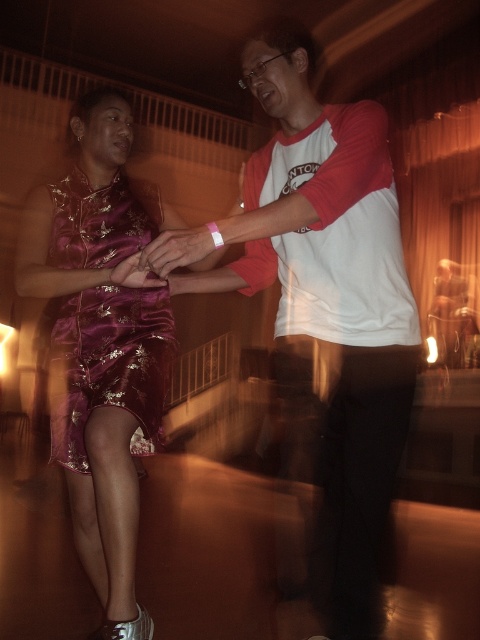
Does shiny purple dress at center appear on the right side of matte gold ring at center?

No, shiny purple dress at center is not to the right of matte gold ring at center.

How much distance is there between shiny purple dress at center and matte gold ring at center?

shiny purple dress at center and matte gold ring at center are 37.07 centimeters apart.

Find the location of a particular element. shiny purple dress at center is located at coordinates (108, 365).

At what (x,y) coordinates should I click in order to perform the action: click on shiny purple dress at center. Please return your answer as a coordinate pair (x, y). Looking at the image, I should click on (108, 365).

Find the location of a particular element. white/red raglan shirt at center is located at coordinates (327, 316).

Does white/red raglan shirt at center have a lesser height compared to shiny purple dress at left?

Correct, white/red raglan shirt at center is not as tall as shiny purple dress at left.

Identify the location of white/red raglan shirt at center. This screenshot has height=640, width=480. (327, 316).

What are the coordinates of `white/red raglan shirt at center` in the screenshot? It's located at (327, 316).

Describe the element at coordinates (327, 316) in the screenshot. This screenshot has height=640, width=480. I see `white/red raglan shirt at center` at that location.

Which is more to the left, white/red raglan shirt at center or shiny purple dress at center?

shiny purple dress at center is more to the left.

Who is more distant from viewer, (409, 394) or (54, 353)?

The point (54, 353) is more distant.

Locate an element on the screen. The height and width of the screenshot is (640, 480). white/red raglan shirt at center is located at coordinates (327, 316).